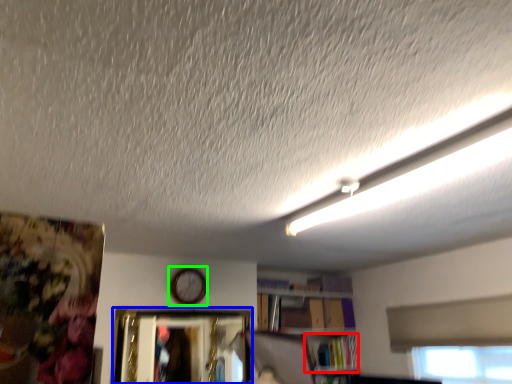
Question: Which object is positioned closest to book (highlighted by a red box)? Select from picture frame (highlighted by a blue box) and clock (highlighted by a green box).

Choices:
 (A) picture frame
 (B) clock

Answer: (A)